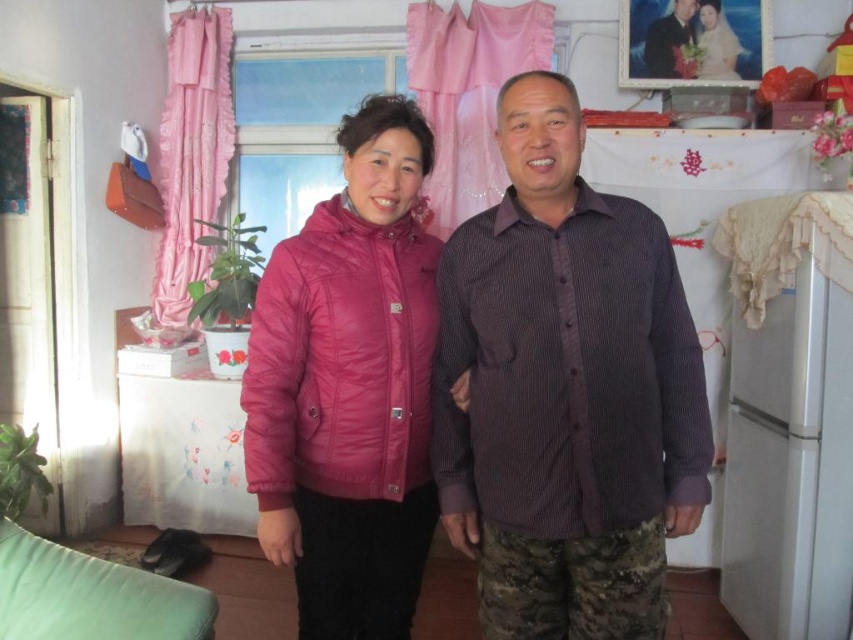
Is pink quilted jacket at center bigger than dark blue corduroy shirt at center?

Correct, pink quilted jacket at center is larger in size than dark blue corduroy shirt at center.

Can you confirm if pink quilted jacket at center is thinner than dark blue corduroy shirt at center?

Incorrect, pink quilted jacket at center's width is not less than dark blue corduroy shirt at center's.

Image resolution: width=853 pixels, height=640 pixels. Identify the location of pink quilted jacket at center. (349, 387).

Can you confirm if purple corduroy shirt at center is smaller than white matte refrigerator at right?

Indeed, purple corduroy shirt at center has a smaller size compared to white matte refrigerator at right.

Does purple corduroy shirt at center appear under white matte refrigerator at right?

No.

Which is behind, point (554, 513) or point (786, 397)?

Positioned behind is point (786, 397).

The height and width of the screenshot is (640, 853). Identify the location of purple corduroy shirt at center. (566, 390).

Locate an element on the screen. The height and width of the screenshot is (640, 853). purple corduroy shirt at center is located at coordinates (566, 390).

Can you confirm if purple corduroy shirt at center is wider than pink quilted jacket at center?

Indeed, purple corduroy shirt at center has a greater width compared to pink quilted jacket at center.

The image size is (853, 640). Describe the element at coordinates (566, 390) in the screenshot. I see `purple corduroy shirt at center` at that location.

The width and height of the screenshot is (853, 640). I want to click on purple corduroy shirt at center, so click(x=566, y=390).